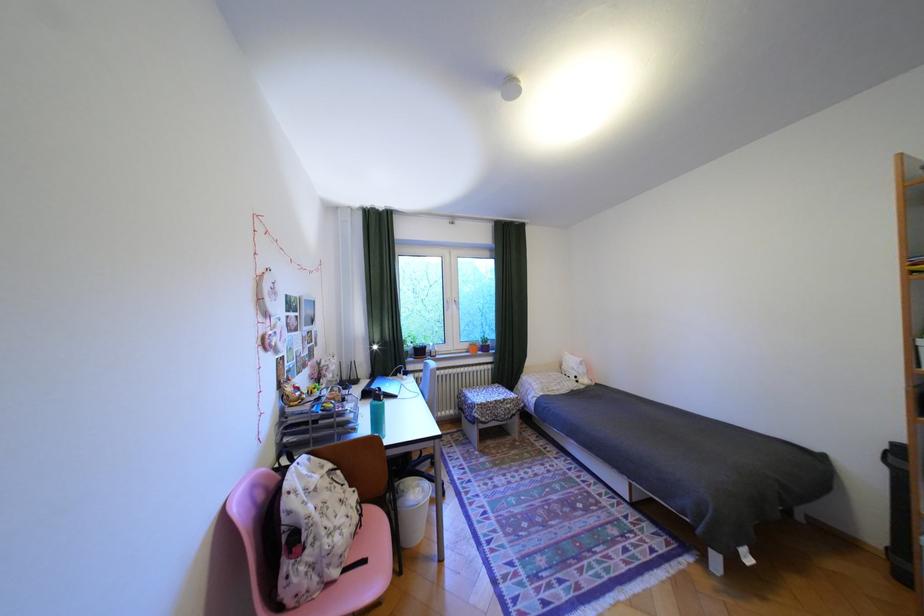
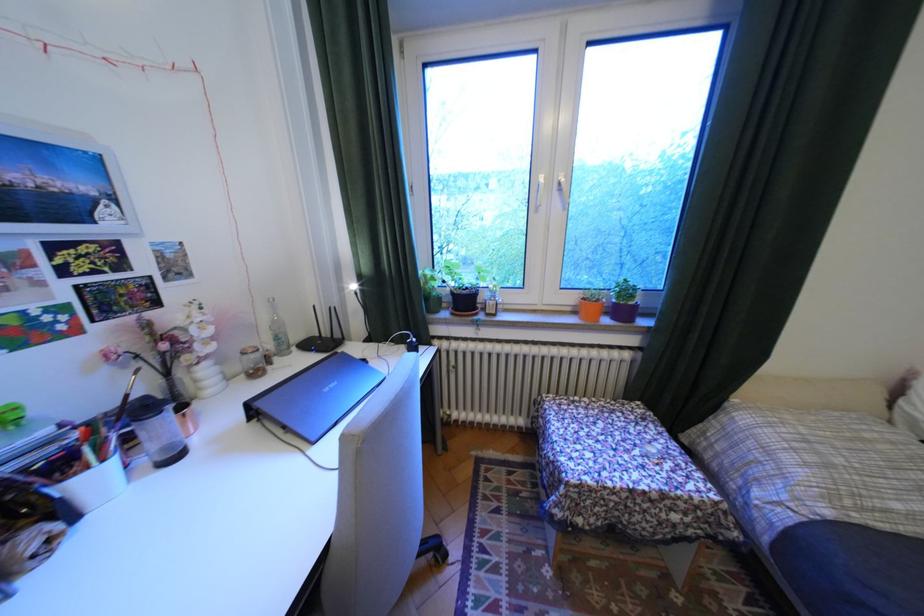
The point at (419, 352) is marked in the first image. Where is the corresponding point in the second image?

(451, 299)